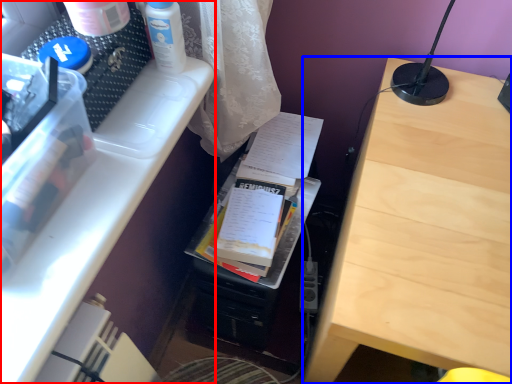
Question: Which of the following is the farthest to the observer, desk (highlighted by a red box) or table (highlighted by a blue box)?

Choices:
 (A) desk
 (B) table

Answer: (B)